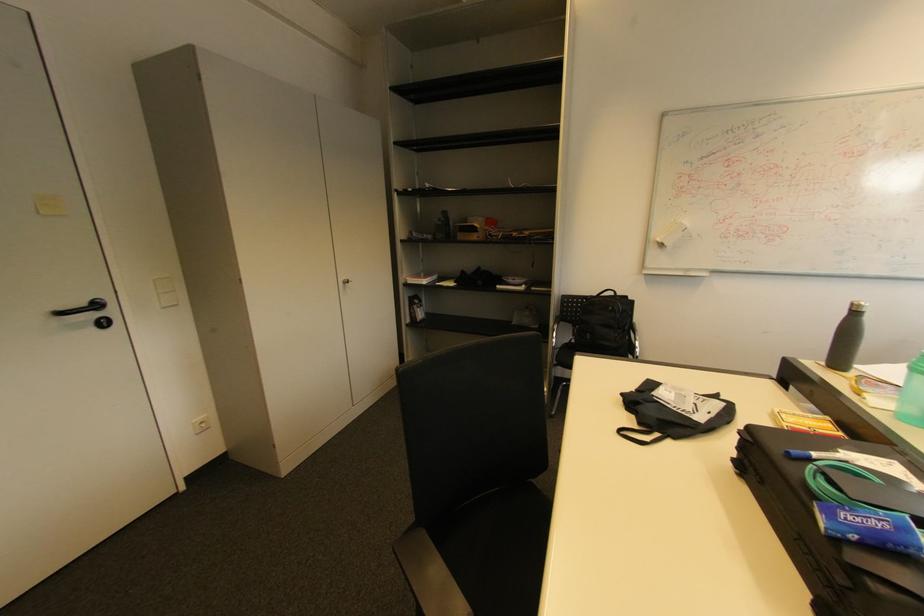
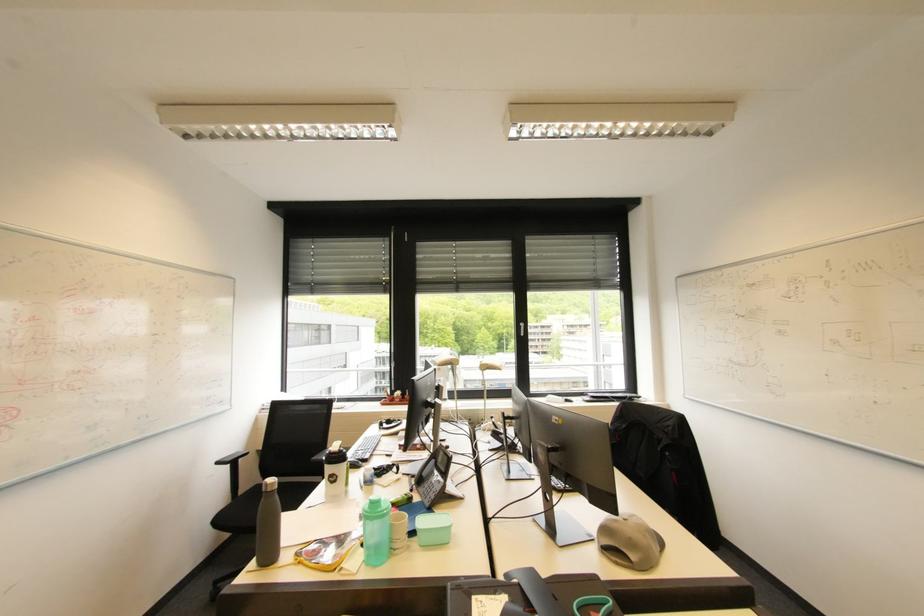
Question: The camera is either moving clockwise (left) or counter-clockwise (right) around the object. The first image is from the beginning of the video and the second image is from the end. Is the camera moving left or right when shooting the video?

Choices:
 (A) Left
 (B) Right

Answer: (A)